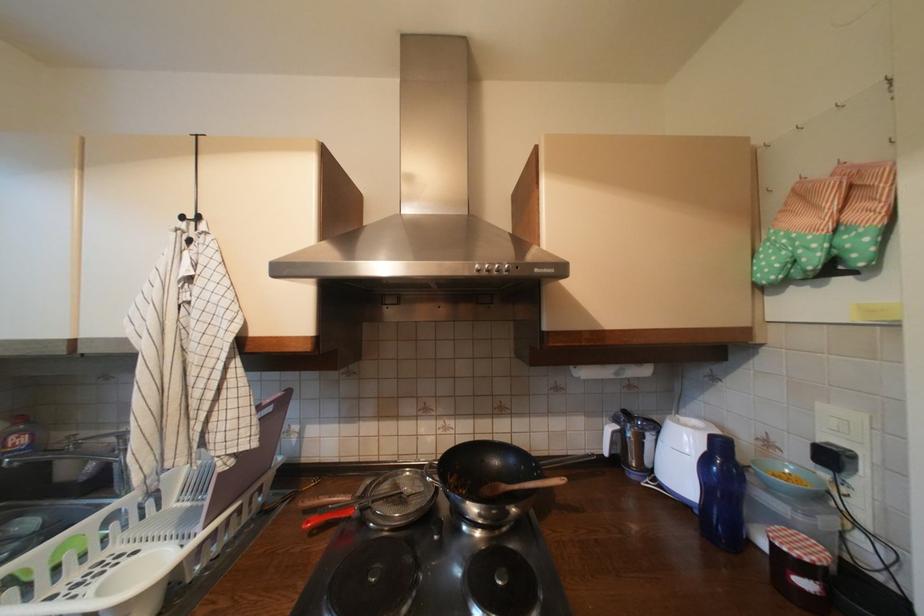
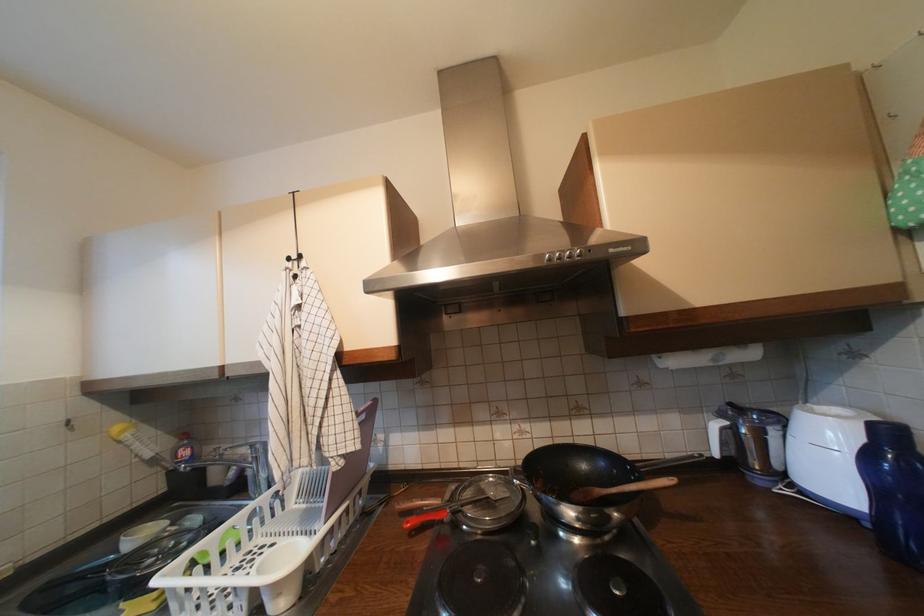
Locate, in the second image, the point that corresponds to point (190, 219) in the first image.

(297, 260)